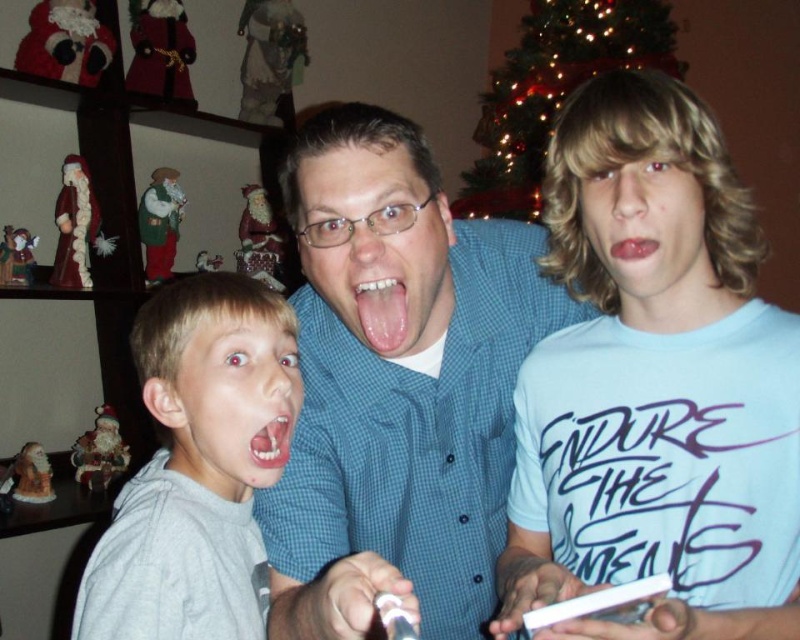
Question: Is gray matte hoodie at left positioned in front of white glossy teeth at center?

Choices:
 (A) yes
 (B) no

Answer: (A)

Question: In this image, where is light blue cotton shirt at right located relative to shiny metallic ornament at upper center?

Choices:
 (A) right
 (B) left

Answer: (B)

Question: Which object appears closest to the camera in this image?

Choices:
 (A) blue checkered shirt at center
 (B) gray matte hoodie at left
 (C) light blue cotton shirt at right
 (D) white glossy teeth at center

Answer: (C)

Question: Is blue checkered shirt at center wider than pink smooth tongue at center?

Choices:
 (A) yes
 (B) no

Answer: (A)

Question: Which of the following is the closest to the observer?

Choices:
 (A) white glossy teeth at center
 (B) light blue cotton shirt at right

Answer: (B)

Question: Which point is farther from the camera taking this photo?

Choices:
 (A) (222, 524)
 (B) (401, 292)
 (C) (400, 234)
 (D) (645, 257)

Answer: (A)